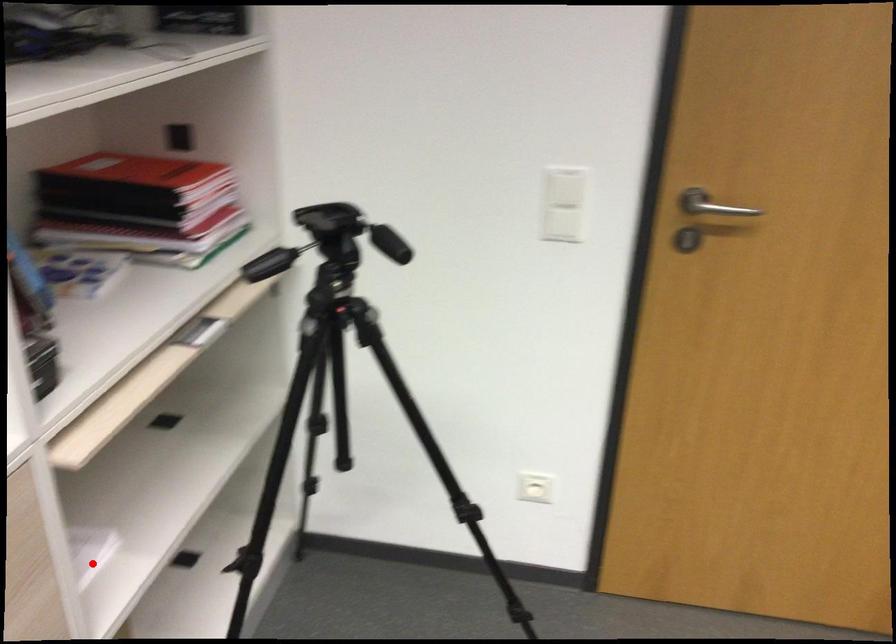
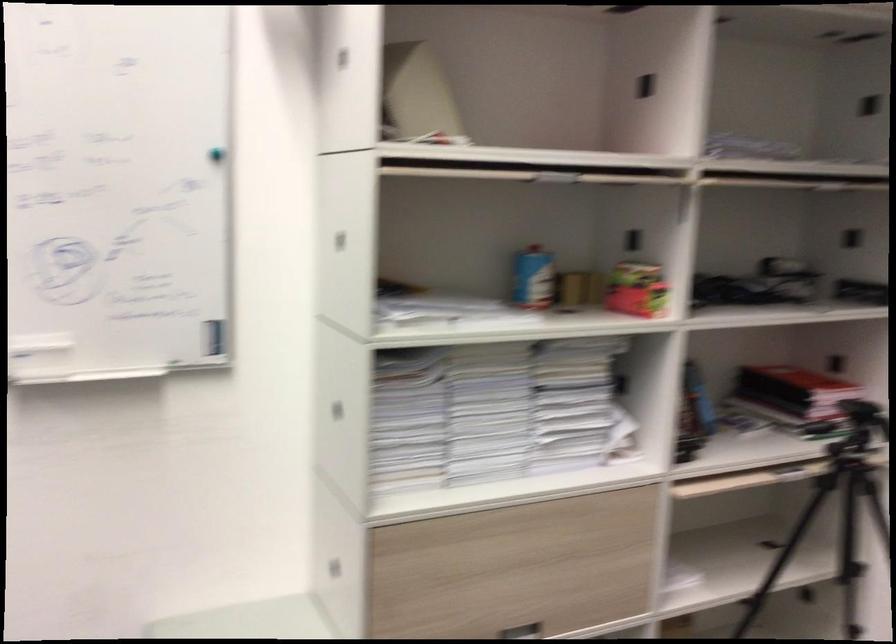
Question: I am providing you with two images of the same scene from different viewpoints. A red point is shown in image1. For the corresponding object point in image2, is it positioned nearer or farther from the camera?

Choices:
 (A) Nearer
 (B) Farther

Answer: (B)